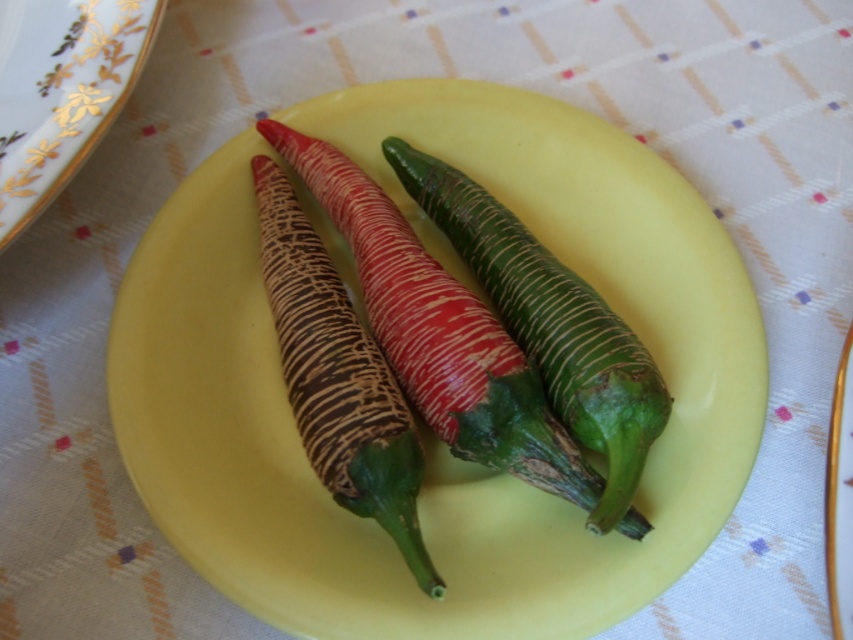
Is yellow glossy plate at center positioned at the back of white porcelain plate at upper left?

No.

Does point (662, 344) come farther from viewer compared to point (143, 20)?

Yes, it is.

Between point (575, 522) and point (0, 156), which one is positioned behind?

Positioned behind is point (575, 522).

You are a GUI agent. You are given a task and a screenshot of the screen. Output one action in this format:
    pyautogui.click(x=<x>, y=<y>)
    Task: Click on the yellow glossy plate at center
    Image resolution: width=853 pixels, height=640 pixels.
    Given the screenshot: What is the action you would take?
    pyautogui.click(x=428, y=432)

The image size is (853, 640). Identify the location of yellow glossy plate at center. (428, 432).

Is yellow glossy plate at center closer to camera compared to textured brown chili pepper at center?

No.

Locate an element on the screen. yellow glossy plate at center is located at coordinates (428, 432).

Is green textured chili pepper at center bigger than textured brown chili pepper at center?

Indeed, green textured chili pepper at center has a larger size compared to textured brown chili pepper at center.

Is point (602, 339) positioned in front of point (376, 474)?

No, (602, 339) is behind (376, 474).

Does point (641, 433) lie behind point (343, 481)?

Yes, point (641, 433) is farther from viewer.

Locate an element on the screen. green textured chili pepper at center is located at coordinates (550, 324).